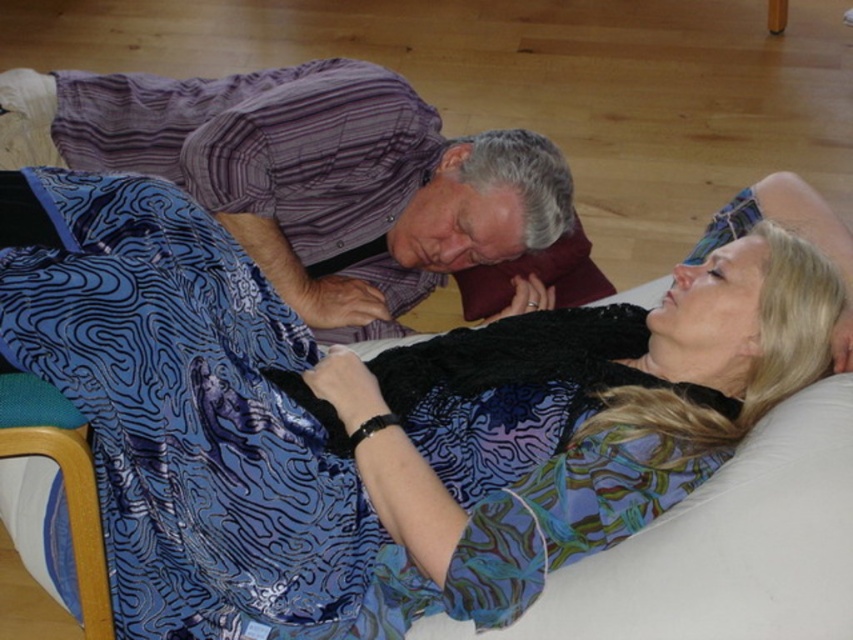
You are a photographer trying to capture a candid shot of the scene. You notice the silky blue dress at center and the purple striped shirt at upper center. Which clothing item would you need to frame wider in your camera to ensure it fits properly?

The silky blue dress at center is wider than the purple striped shirt at upper center, so you would need to frame the silky blue dress at center wider to ensure it fits properly in the camera shot.

You are a photographer positioned at point (380, 419) in the image. What object is directly in front of you?

The silky blue dress at center is directly in front of you at point (380, 419).

You are a photographer positioned at the back of the scene. You want to take a photo of both the silky blue dress at center and the purple striped shirt at upper center. However, you notice that one of them is blocking the other. Which object is blocking the other?

The silky blue dress at center is blocking the purple striped shirt at upper center because it is positioned in front of it.